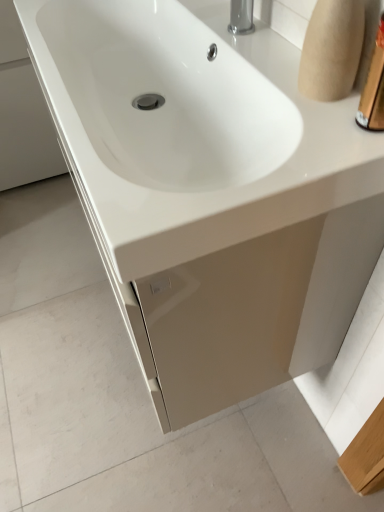
Locate an element on the screen. white glossy sink at center is located at coordinates (191, 129).

Image resolution: width=384 pixels, height=512 pixels. What do you see at coordinates (191, 129) in the screenshot?
I see `white glossy sink at center` at bounding box center [191, 129].

What is the approximate height of white glossy sink at center?

white glossy sink at center is 3.88 inches tall.

Locate an element on the screen. This screenshot has height=512, width=384. gold metallic container at upper right is located at coordinates (374, 88).

What do you see at coordinates (374, 88) in the screenshot? This screenshot has height=512, width=384. I see `gold metallic container at upper right` at bounding box center [374, 88].

The height and width of the screenshot is (512, 384). What are the coordinates of `white glossy sink at center` in the screenshot? It's located at (191, 129).

Based on their positions, is white glossy sink at center located to the left or right of gold metallic container at upper right?

From the image, it's evident that white glossy sink at center is to the left of gold metallic container at upper right.

Relative to gold metallic container at upper right, is white glossy sink at center in front or behind?

white glossy sink at center is positioned farther from the viewer than gold metallic container at upper right.

Does point (188, 182) come closer to viewer compared to point (375, 85)?

No, it is not.

From the image's perspective, is white glossy sink at center on gold metallic container at upper right?

Correct, white glossy sink at center appears higher than gold metallic container at upper right in the image.

From a real-world perspective, is white glossy sink at center on top of gold metallic container at upper right?

No, from a real-world perspective, white glossy sink at center is not on top of gold metallic container at upper right.

Does white glossy sink at center have a greater width compared to gold metallic container at upper right?

Correct, the width of white glossy sink at center exceeds that of gold metallic container at upper right.

Considering the relative sizes of white glossy sink at center and gold metallic container at upper right in the image provided, is white glossy sink at center shorter than gold metallic container at upper right?

Correct, white glossy sink at center is not as tall as gold metallic container at upper right.

Between white glossy sink at center and gold metallic container at upper right, which one has smaller size?

gold metallic container at upper right is smaller.

Would you say white glossy sink at center contains gold metallic container at upper right?

No.

Is white glossy sink at center not near gold metallic container at upper right?

white glossy sink at center is near gold metallic container at upper right, not far away.

Could you tell me if white glossy sink at center is facing gold metallic container at upper right?

No, white glossy sink at center is not oriented towards gold metallic container at upper right.

Can you tell me how much white glossy sink at center and gold metallic container at upper right differ in facing direction?

The angle between the facing direction of white glossy sink at center and the facing direction of gold metallic container at upper right is 2.77e-05 degrees.

Locate an element on the screen. toiletry in front of the white glossy sink at center is located at coordinates pos(374,88).

Considering the relative positions of gold metallic container at upper right and white glossy sink at center in the image provided, is gold metallic container at upper right to the left or to the right of white glossy sink at center?

In the image, gold metallic container at upper right appears on the right side of white glossy sink at center.

Which object is closer to the camera taking this photo, gold metallic container at upper right or white glossy sink at center?

gold metallic container at upper right is more forward.

Between point (378, 39) and point (108, 94), which one is positioned in front?

Positioned in front is point (378, 39).

From the picture: From the image's perspective, which one is positioned lower, gold metallic container at upper right or white glossy sink at center?

gold metallic container at upper right is shown below in the image.

From a real-world perspective, is gold metallic container at upper right physically above white glossy sink at center?

Indeed, from a real-world perspective, gold metallic container at upper right stands above white glossy sink at center.

Which of these two, gold metallic container at upper right or white glossy sink at center, is wider?

Wider between the two is white glossy sink at center.

Considering the sizes of objects gold metallic container at upper right and white glossy sink at center in the image provided, who is shorter, gold metallic container at upper right or white glossy sink at center?

With less height is white glossy sink at center.

Is gold metallic container at upper right bigger than white glossy sink at center?

Actually, gold metallic container at upper right might be smaller than white glossy sink at center.

Is gold metallic container at upper right outside of white glossy sink at center?

Yes, gold metallic container at upper right is not within white glossy sink at center.

Is gold metallic container at upper right in contact with white glossy sink at center?

gold metallic container at upper right and white glossy sink at center are clearly separated.

Does gold metallic container at upper right turn towards white glossy sink at center?

No, gold metallic container at upper right is not aimed at white glossy sink at center.

How different are the orientations of gold metallic container at upper right and white glossy sink at center in degrees?

There is a 2.77e-05-degree angle between the facing directions of gold metallic container at upper right and white glossy sink at center.

The height and width of the screenshot is (512, 384). Identify the location of sink on the left of gold metallic container at upper right. (191, 129).

The image size is (384, 512). I want to click on sink lying above the gold metallic container at upper right (from the image's perspective), so click(191, 129).

Locate an element on the screen. This screenshot has width=384, height=512. toiletry below the white glossy sink at center (from the image's perspective) is located at coordinates (374, 88).